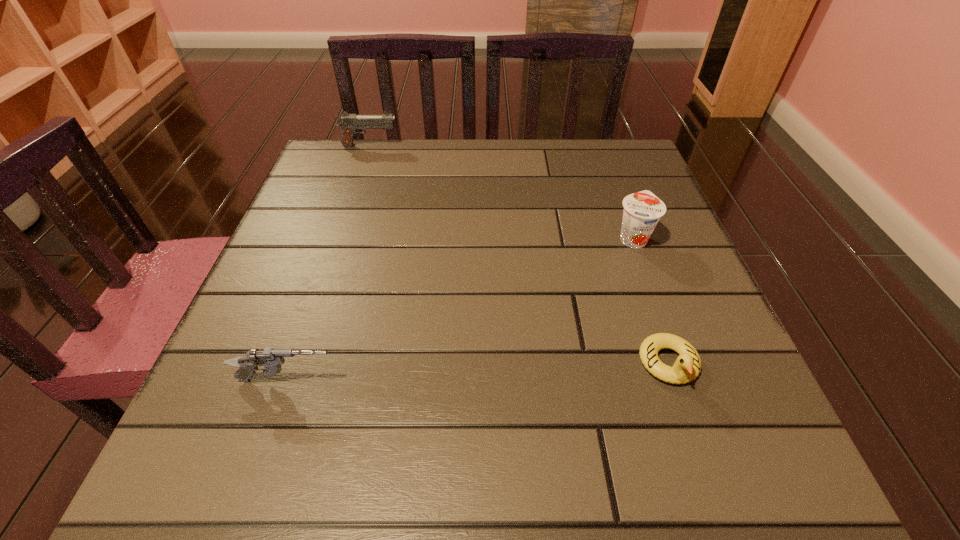
Find the location of a particular element. the farthest object is located at coordinates (349, 123).

Locate an element on the screen. This screenshot has height=540, width=960. the taller gun is located at coordinates (349, 123).

Locate an element on the screen. yogurt is located at coordinates (642, 210).

At what (x,y) coordinates should I click in order to perform the action: click on the nearer gun. Please return your answer as a coordinate pair (x, y). The width and height of the screenshot is (960, 540). Looking at the image, I should click on (271, 359).

Identify the location of the shortest object. This screenshot has width=960, height=540. (687, 366).

Locate an element on the screen. free space located 0.130m in the direction the taller gun is aimed is located at coordinates (450, 146).

The width and height of the screenshot is (960, 540). Identify the location of vacant space located 0.140m on the front of the second farthest object. (659, 309).

I want to click on vacant region located 0.190m at the barrel of the nearer gun, so click(x=467, y=380).

You are a GUI agent. You are given a task and a screenshot of the screen. Output one action in this format:
    pyautogui.click(x=<x>, y=<y>)
    Task: Click on the free space located on the face of the duckling
    Image resolution: width=960 pixels, height=540 pixels.
    Given the screenshot: What is the action you would take?
    pyautogui.click(x=700, y=454)

Image resolution: width=960 pixels, height=540 pixels. Find the location of `object located in the far edge section of the desktop`. object located in the far edge section of the desktop is located at coordinates (349, 123).